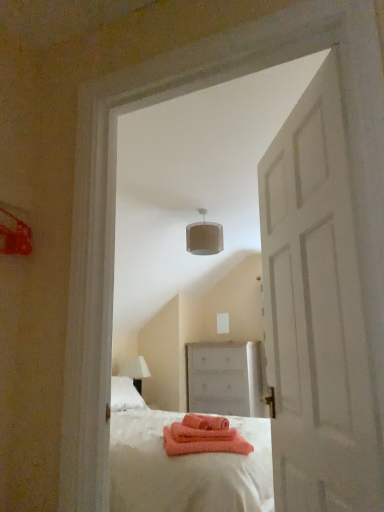
Question: From a real-world perspective, is white matte chest of drawers at center above or below white textured lampshade at upper center?

Choices:
 (A) above
 (B) below

Answer: (B)

Question: In terms of height, does white matte chest of drawers at center look taller or shorter compared to white textured lampshade at upper center?

Choices:
 (A) tall
 (B) short

Answer: (A)

Question: Which of these objects is positioned farthest from the white matte chest of drawers at center?

Choices:
 (A) white textured lampshade at upper center
 (B) white matte door at center
 (C) white fabric lampshade at left

Answer: (B)

Question: Based on their relative distances, which object is farther from the white fabric lampshade at left?

Choices:
 (A) white textured lampshade at upper center
 (B) white matte chest of drawers at center
 (C) white matte door at center

Answer: (C)